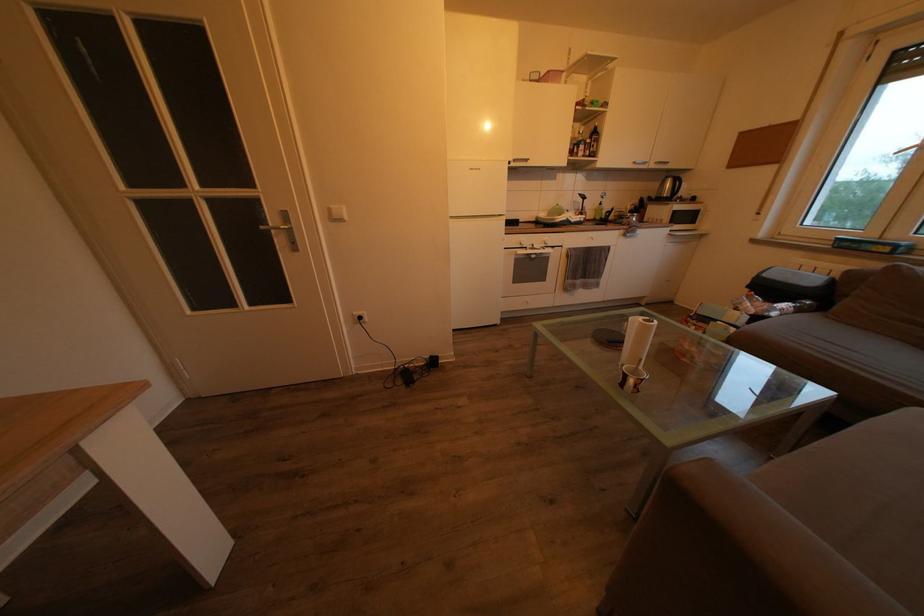
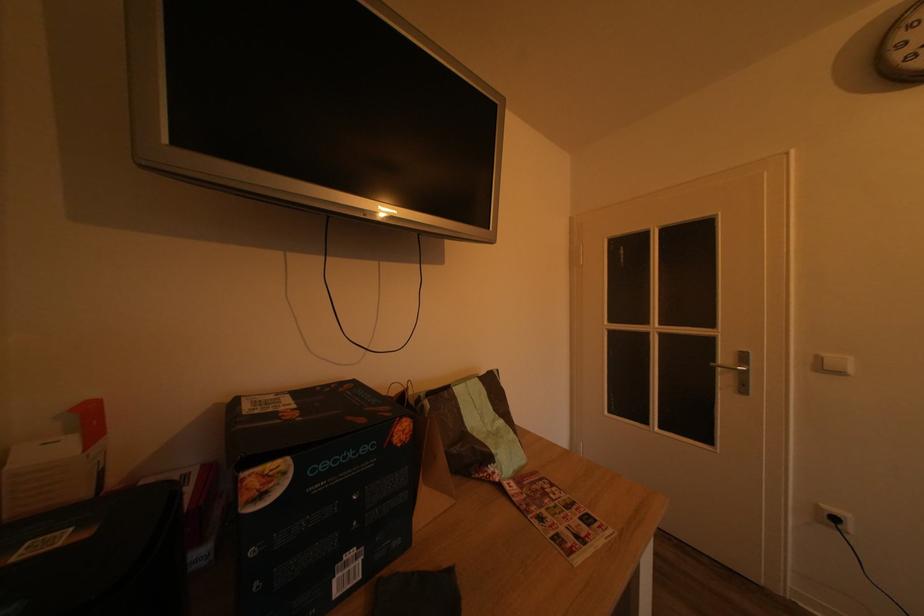
Question: The camera is either moving clockwise (left) or counter-clockwise (right) around the object. The first image is from the beginning of the video and the second image is from the end. Is the camera moving left or right when shooting the video?

Choices:
 (A) Left
 (B) Right

Answer: (B)